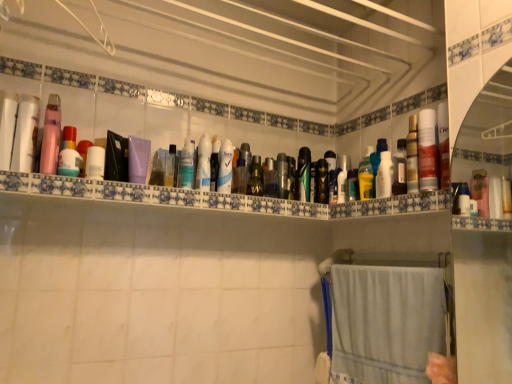
This screenshot has width=512, height=384. Describe the element at coordinates (384, 176) in the screenshot. I see `white glossy lotion at center, marked as the twentieth toiletry in a left-to-right arrangement` at that location.

Describe the element at coordinates (51, 136) in the screenshot. I see `pink matte lotion at upper left, the 21th toiletry in the right-to-left sequence` at that location.

This screenshot has height=384, width=512. Describe the element at coordinates (217, 198) in the screenshot. I see `translucent plastic bottles at upper center` at that location.

Image resolution: width=512 pixels, height=384 pixels. Identify the location of translucent plastic bottle at center, which is the fourth toiletry from right to left. (353, 185).

The height and width of the screenshot is (384, 512). What are the coordinates of `white glossy lotion at center, marked as the twentieth toiletry in a left-to-right arrangement` in the screenshot? It's located at (384, 176).

Which of these two, matte white lotion at left, which is the 22th toiletry in right-to-left order, or white fabric towel bar at lower center, is smaller?

Smaller between the two is matte white lotion at left, which is the 22th toiletry in right-to-left order.

Can you tell me how much matte white lotion at left, which is the first toiletry from left to right, and white fabric towel bar at lower center differ in facing direction?

92.8 degrees.

Between matte white lotion at left, which is the first toiletry from left to right, and white fabric towel bar at lower center, which one is positioned behind?

white fabric towel bar at lower center is behind.

Identify the location of towel bar beneath the matte white lotion at left, which is the first toiletry from left to right (from a real-world perspective). (384, 259).

Consider the image. From the image's perspective, which is below, matte white lotion at left, which is the first toiletry from left to right, or matte white can at right, the first toiletry when ordered from right to left?

From the image's view, matte white can at right, the first toiletry when ordered from right to left, is below.

Is matte white lotion at left, which is the first toiletry from left to right, wider than matte white can at right, acting as the 22th toiletry starting from the left?

Yes.

Is matte white lotion at left, which is the 22th toiletry in right-to-left order, not close to matte white can at right, acting as the 22th toiletry starting from the left?

Yes, matte white lotion at left, which is the 22th toiletry in right-to-left order, and matte white can at right, acting as the 22th toiletry starting from the left, are located far from each other.

Which object is more forward, matte white lotion at left, which is the 22th toiletry in right-to-left order, or matte white can at right, acting as the 22th toiletry starting from the left?

matte white lotion at left, which is the 22th toiletry in right-to-left order.

Is white fabric towel bar at lower center surrounding translucent plastic bottle at center, which is the fourth toiletry from right to left?

No, white fabric towel bar at lower center does not contain translucent plastic bottle at center, which is the fourth toiletry from right to left.

Is white fabric towel bar at lower center aimed at translucent plastic bottle at center, the 19th toiletry from the left?

No, white fabric towel bar at lower center is not oriented towards translucent plastic bottle at center, the 19th toiletry from the left.

Which object is further away from the camera, white fabric towel bar at lower center or translucent plastic bottle at center, the 19th toiletry from the left?

Positioned behind is translucent plastic bottle at center, the 19th toiletry from the left.

Would you say white fabric towel bar at lower center is a long distance from translucent plastic bottle at center, which is the fourth toiletry from right to left?

white fabric towel bar at lower center is near translucent plastic bottle at center, which is the fourth toiletry from right to left, not far away.

Relative to pink matte lotion at upper left, the second toiletry from the left, is white glossy lotion at center, which is counted as the eighteenth toiletry, starting from the left, in front or behind?

Visually, white glossy lotion at center, which is counted as the eighteenth toiletry, starting from the left, is located behind pink matte lotion at upper left, the second toiletry from the left.

Which is closer to the camera, [337,198] or [60,110]?

Point [337,198] is positioned farther from the camera compared to point [60,110].

Where is `the 16th toiletry counting from the left of the white glossy lotion at center, which is the fifth toiletry in right-to-left order`? the 16th toiletry counting from the left of the white glossy lotion at center, which is the fifth toiletry in right-to-left order is located at coordinates (x=51, y=136).

Who is bigger, matte white can at right, the first toiletry when ordered from right to left, or metallic silver can at center, the 10th toiletry from the right?

With larger size is matte white can at right, the first toiletry when ordered from right to left.

From a real-world perspective, is matte white can at right, the first toiletry when ordered from right to left, on metallic silver can at center, the 10th toiletry from the right?

A: Indeed, from a real-world perspective, matte white can at right, the first toiletry when ordered from right to left, stands above metallic silver can at center, the 10th toiletry from the right.

Is matte white can at right, the first toiletry when ordered from right to left, taller or shorter than metallic silver can at center, the 10th toiletry from the right?

Clearly, matte white can at right, the first toiletry when ordered from right to left, is taller compared to metallic silver can at center, the 10th toiletry from the right.

Is matte white can at right, acting as the 22th toiletry starting from the left, in front of or behind metallic silver can at center, the 13th toiletry viewed from the left, in the image?

matte white can at right, acting as the 22th toiletry starting from the left, is in front of metallic silver can at center, the 13th toiletry viewed from the left.

From the picture: How far apart are green matte bottle at center, the eleventh toiletry positioned from the left, and matte white lotion at left, which is the first toiletry from left to right?

green matte bottle at center, the eleventh toiletry positioned from the left, is 27.39 inches away from matte white lotion at left, which is the first toiletry from left to right.

Between point (259, 179) and point (28, 126), which one is positioned behind?

The point (259, 179) is farther.

Is green matte bottle at center, the eleventh toiletry positioned from the left, far away from matte white lotion at left, which is the first toiletry from left to right?

A: That's not correct — green matte bottle at center, the eleventh toiletry positioned from the left, is a little close to matte white lotion at left, which is the first toiletry from left to right.

Can you confirm if green matte bottle at center, the eleventh toiletry positioned from the left, is bigger than matte white lotion at left, which is the first toiletry from left to right?

No.

Which is behind, white matte bottle at upper left, which appears as the nineteenth toiletry when viewed from the right, or translucent plastic bottles at upper center?

white matte bottle at upper left, which appears as the nineteenth toiletry when viewed from the right, is more distant.

In terms of height, does white matte bottle at upper left, which is counted as the 4th toiletry, starting from the left, look taller or shorter compared to translucent plastic bottles at upper center?

Clearly, white matte bottle at upper left, which is counted as the 4th toiletry, starting from the left, is taller compared to translucent plastic bottles at upper center.

From a real-world perspective, who is located lower, white matte bottle at upper left, which is counted as the 4th toiletry, starting from the left, or translucent plastic bottles at upper center?

From a 3D spatial view, translucent plastic bottles at upper center is below.

Does white matte bottle at upper left, which is counted as the 4th toiletry, starting from the left, have a lesser width compared to translucent plastic bottles at upper center?

Indeed, white matte bottle at upper left, which is counted as the 4th toiletry, starting from the left, has a lesser width compared to translucent plastic bottles at upper center.

Find the location of a particular element. towel bar below the matte white lotion at left, which is the 22th toiletry in right-to-left order (from the image's perspective) is located at coordinates (384, 259).

Where is `the 21st toiletry to the right when counting from the matte white lotion at left, which is the 22th toiletry in right-to-left order`? the 21st toiletry to the right when counting from the matte white lotion at left, which is the 22th toiletry in right-to-left order is located at coordinates (426, 150).

Looking at the image, which one is located closer to black matte hairbrush at center, placed as the sixteenth toiletry when sorted from left to right, clear plastic spray can at center, the 10th toiletry positioned from the left, or white glossy lotion at center, which is counted as the eighteenth toiletry, starting from the left?

white glossy lotion at center, which is counted as the eighteenth toiletry, starting from the left, is closer to black matte hairbrush at center, placed as the sixteenth toiletry when sorted from left to right.

Estimate the real-world distances between objects in this image. Which object is closer to translucent plastic bottles at upper center, matte black can at center, marked as the seventeenth toiletry in a left-to-right arrangement, or matte white can at right, the first toiletry when ordered from right to left?

matte black can at center, marked as the seventeenth toiletry in a left-to-right arrangement, is positioned closer to the anchor translucent plastic bottles at upper center.

Looking at the image, which one is located closer to metallic silver can at center, the 10th toiletry from the right, matte white can at right, acting as the 22th toiletry starting from the left, or matte black can at center, which is the 6th toiletry from right to left?

Based on the image, matte black can at center, which is the 6th toiletry from right to left, appears to be nearer to metallic silver can at center, the 10th toiletry from the right.

Based on the photo, based on their spatial positions, is clear plastic bottle at center, placed as the 9th toiletry when sorted from right to left, or white fabric towel bar at lower center further from clear plastic spray can at center, the 10th toiletry positioned from the left?

white fabric towel bar at lower center is further to clear plastic spray can at center, the 10th toiletry positioned from the left.

From the picture: Considering their positions, is green matte bottle at center, placed as the 12th toiletry when sorted from right to left, positioned further to pink matte lotion at upper left, the second toiletry from the left, than purple matte bottle at center, placed as the 18th toiletry when sorted from right to left?

The object further to pink matte lotion at upper left, the second toiletry from the left, is green matte bottle at center, placed as the 12th toiletry when sorted from right to left.

From the image, which object appears to be farther from black matte hairbrush at center, arranged as the seventh toiletry when viewed from the right, translucent plastic bottle at center, which is the third toiletry in left-to-right order, or pink matte lotion at upper left, the second toiletry from the left?

Among the two, pink matte lotion at upper left, the second toiletry from the left, is located further to black matte hairbrush at center, arranged as the seventh toiletry when viewed from the right.

Which object lies further to the anchor point white fabric towel bar at lower center, translucent plastic bottle at center, which is the fourth toiletry from right to left, or matte white lotion at left, which is the 22th toiletry in right-to-left order?

matte white lotion at left, which is the 22th toiletry in right-to-left order, is positioned further to the anchor white fabric towel bar at lower center.

From the image, which object appears to be farther from matte white lotion at left, which is the 22th toiletry in right-to-left order, white matte deodorant at center, the 8th toiletry when ordered from left to right, or clear plastic spray can at center, the 10th toiletry positioned from the left?

clear plastic spray can at center, the 10th toiletry positioned from the left, is positioned further to the anchor matte white lotion at left, which is the 22th toiletry in right-to-left order.

This screenshot has width=512, height=384. What are the coordinates of `shelve between transparent plastic bottle at center, which is the sixth toiletry from left to right, and clear plastic bottle at upper center, the 21th toiletry in the left-to-right sequence` in the screenshot? It's located at (217, 198).

This screenshot has height=384, width=512. In order to click on bath towel between transparent plastic bottle at center, which is the sixth toiletry from left to right, and matte white can at right, the first toiletry when ordered from right to left, in the horizontal direction in this screenshot , I will do `click(386, 323)`.

Identify the location of shelve between translucent plastic bottle at center, which is the third toiletry in left-to-right order, and white fabric towel bar at lower center, in the horizontal direction. (217, 198).

Where is `shelve between purple matte bottle at center, acting as the 5th toiletry starting from the left, and white fabric bath towel at lower right, in the horizontal direction`? The width and height of the screenshot is (512, 384). shelve between purple matte bottle at center, acting as the 5th toiletry starting from the left, and white fabric bath towel at lower right, in the horizontal direction is located at coordinates (217, 198).